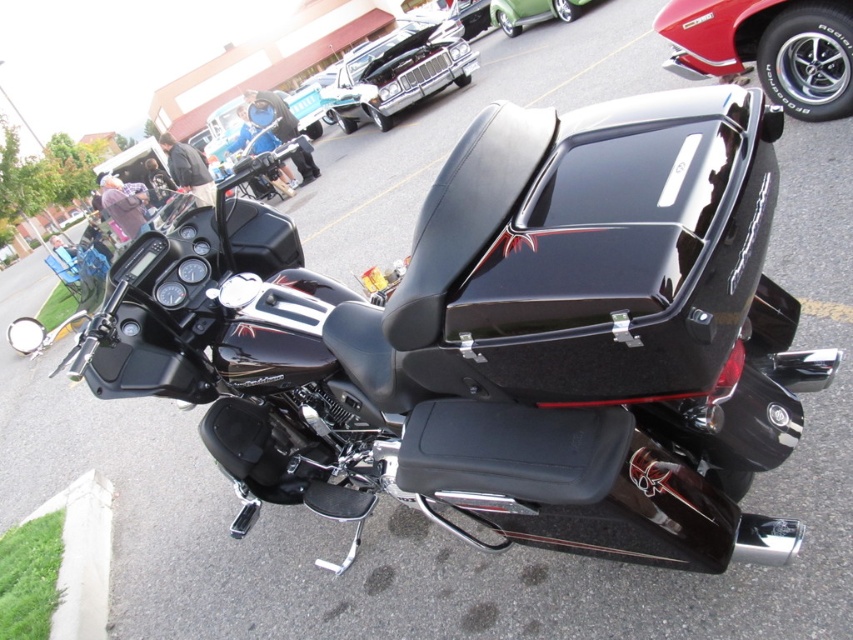
Is shiny chrome car at upper center closer to the viewer compared to green glossy car at upper center?

No, it is behind green glossy car at upper center.

Is shiny chrome car at upper center further to the viewer compared to green glossy car at upper center?

Yes, it is behind green glossy car at upper center.

The image size is (853, 640). I want to click on shiny chrome car at upper center, so click(x=397, y=74).

Does glossy red car at upper right appear on the right side of green grass at lower left?

Indeed, glossy red car at upper right is positioned on the right side of green grass at lower left.

Who is taller, glossy red car at upper right or green grass at lower left?

Standing taller between the two is glossy red car at upper right.

This screenshot has width=853, height=640. Describe the element at coordinates (769, 48) in the screenshot. I see `glossy red car at upper right` at that location.

Where is `glossy red car at upper right`? The image size is (853, 640). glossy red car at upper right is located at coordinates (769, 48).

Between green grass at lower left and green glossy car at upper center, which one has less height?

green grass at lower left is shorter.

Is green grass at lower left below green glossy car at upper center?

Correct, green grass at lower left is located below green glossy car at upper center.

Is point (91, 576) behind point (544, 8)?

No, it is in front of (544, 8).

The width and height of the screenshot is (853, 640). I want to click on green grass at lower left, so click(x=82, y=556).